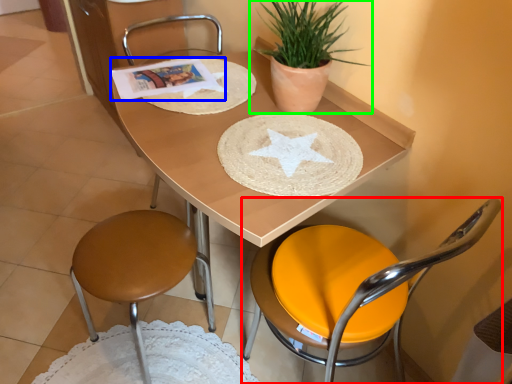
Question: Based on their relative distances, which object is farther from chair (highlighted by a red box)? Choose from magazine (highlighted by a blue box) and houseplant (highlighted by a green box).

Choices:
 (A) magazine
 (B) houseplant

Answer: (A)